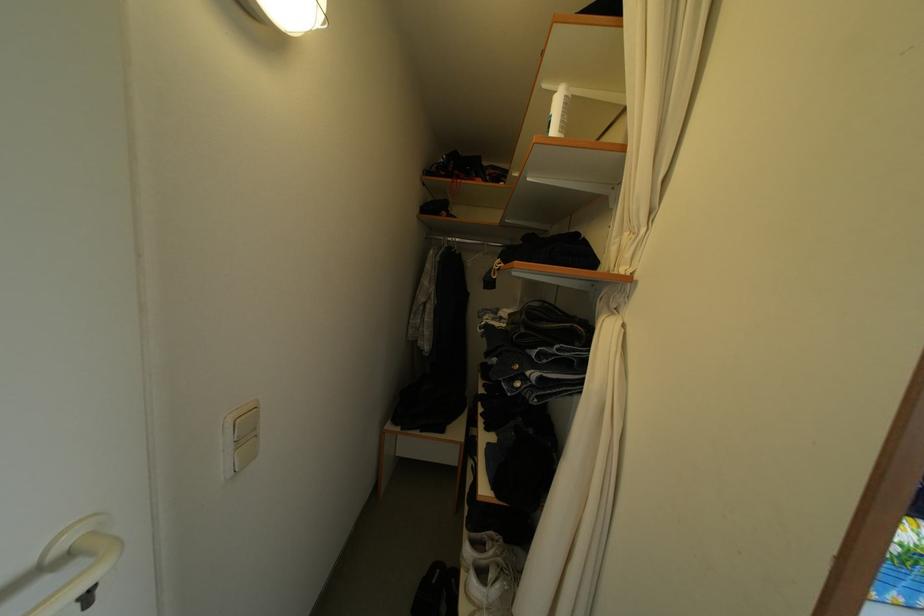
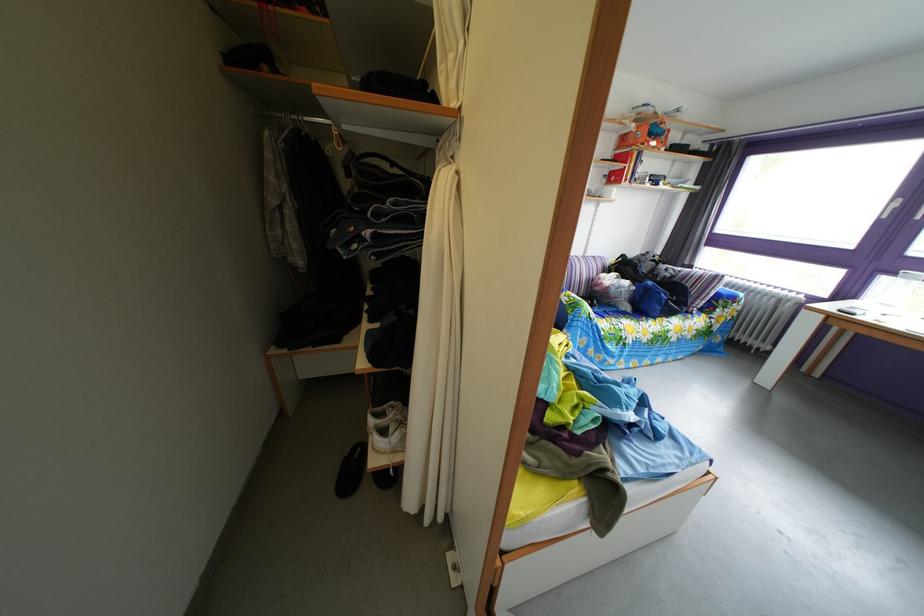
Locate, in the second image, the point that corresponds to point (479, 560) in the first image.

(383, 430)